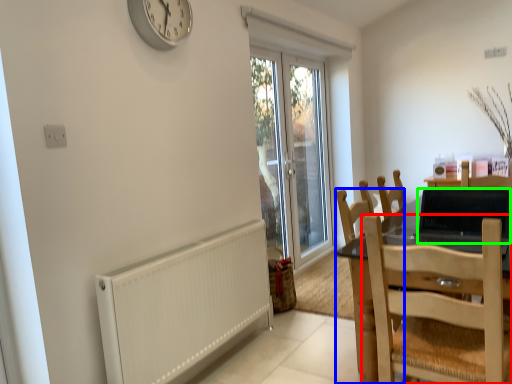
Question: Considering the real-world distances, which object is farthest from chair (highlighted by a red box)? chair (highlighted by a blue box) or laptop (highlighted by a green box)?

Choices:
 (A) chair
 (B) laptop

Answer: (B)